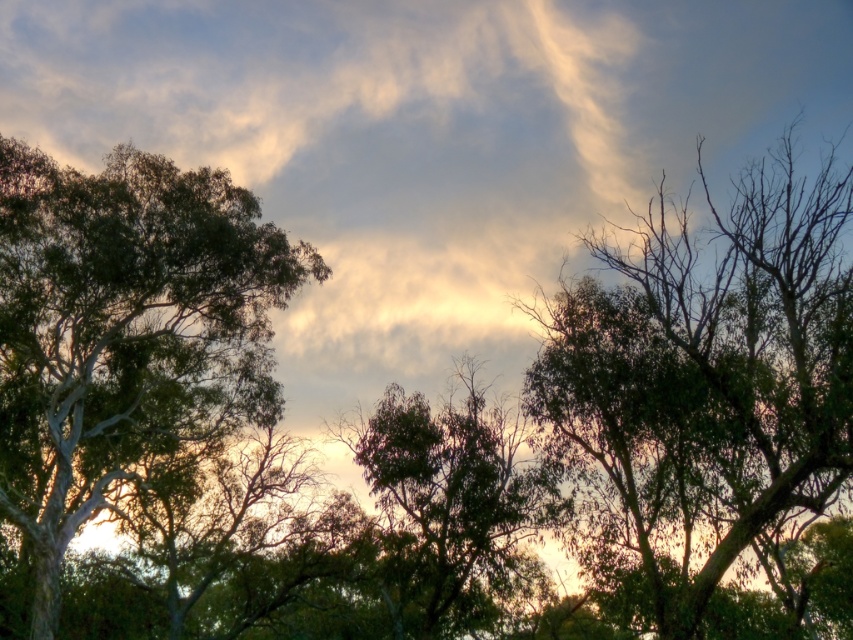
You are an artist planning to paint the scene. You need to decide which tree to focus on for a detailed sketch. If you want to capture a tree with a wider canopy, which one should you choose between the green leafy tree at right and the green leafy tree at center?

The green leafy tree at right might be wider than the green leafy tree at center, so you should choose the green leafy tree at right for a detailed sketch if you want to capture a wider canopy.

Consider the image. You are standing in the serene natural scene with the trees and the dramatic sky. There is a point marked at coordinates point (125,332). Can you tell me which object this point is located on?

The point (125,332) is located on the green leafy tree at upper left.

You are an artist sketching the scene and want to add details to the background. Which tree, the green leafy tree at upper left or the green leafy tree at center, should you draw first to ensure proper layering?

The green leafy tree at upper left should be drawn first because it is in front of the green leafy tree at center, so you need to layer it over the background tree to maintain the correct spatial relationship.